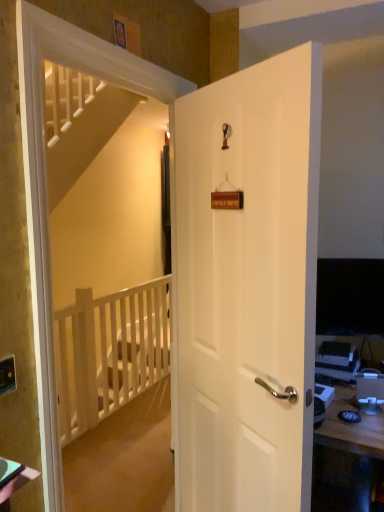
Question: From the image's perspective, is white matte door at center over matte black desktop computer at right?

Choices:
 (A) yes
 (B) no

Answer: (A)

Question: From a real-world perspective, is white matte door at center on top of matte black desktop computer at right?

Choices:
 (A) no
 (B) yes

Answer: (B)

Question: Would you consider white matte door at center to be distant from matte black desktop computer at right?

Choices:
 (A) no
 (B) yes

Answer: (A)

Question: Does white matte door at center lie in front of matte black desktop computer at right?

Choices:
 (A) no
 (B) yes

Answer: (B)

Question: From a real-world perspective, is white matte door at center beneath matte black desktop computer at right?

Choices:
 (A) no
 (B) yes

Answer: (A)

Question: Considering the relative positions of white matte door at center and matte black desktop computer at right in the image provided, is white matte door at center to the right of matte black desktop computer at right from the viewer's perspective?

Choices:
 (A) no
 (B) yes

Answer: (A)

Question: Is matte black outlet at lower left bigger than white matte door at center?

Choices:
 (A) no
 (B) yes

Answer: (A)

Question: Is matte black outlet at lower left to the left of white matte door at center from the viewer's perspective?

Choices:
 (A) no
 (B) yes

Answer: (B)

Question: From a real-world perspective, is matte black outlet at lower left physically below white matte door at center?

Choices:
 (A) yes
 (B) no

Answer: (B)

Question: Is matte black outlet at lower left closer to the viewer compared to white matte door at center?

Choices:
 (A) no
 (B) yes

Answer: (B)

Question: From a real-world perspective, does matte black outlet at lower left stand above white matte door at center?

Choices:
 (A) yes
 (B) no

Answer: (A)

Question: Can you confirm if matte black outlet at lower left is positioned to the right of white matte door at center?

Choices:
 (A) no
 (B) yes

Answer: (A)

Question: Is matte black desktop computer at right to the left of white matte door at center from the viewer's perspective?

Choices:
 (A) yes
 (B) no

Answer: (B)